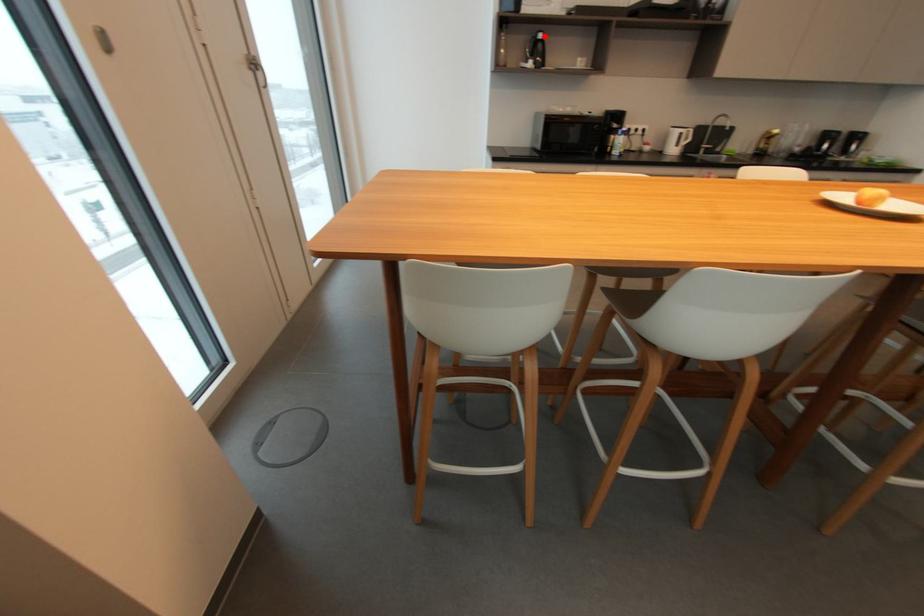
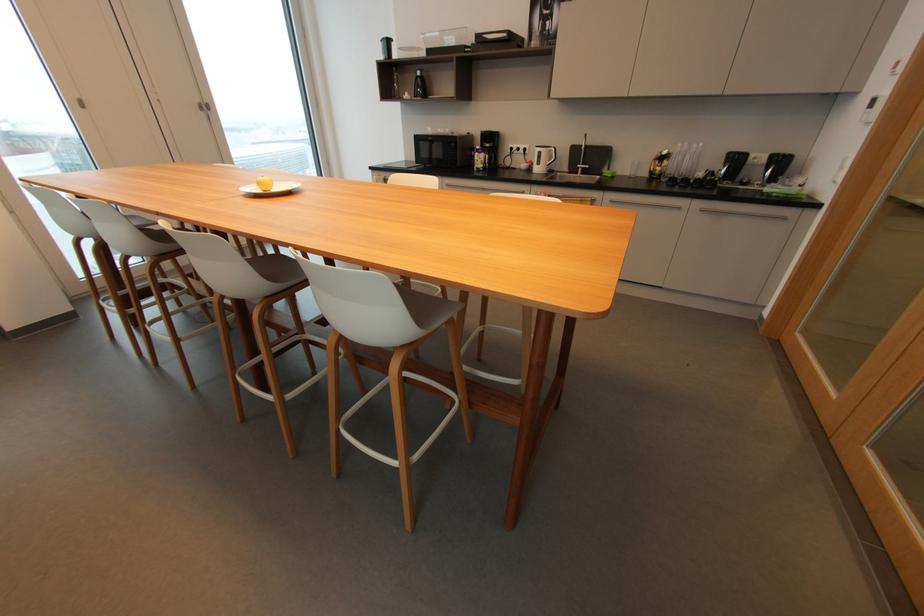
The point at the highlighted location is marked in the first image. Where is the corresponding point in the second image?

(421, 74)